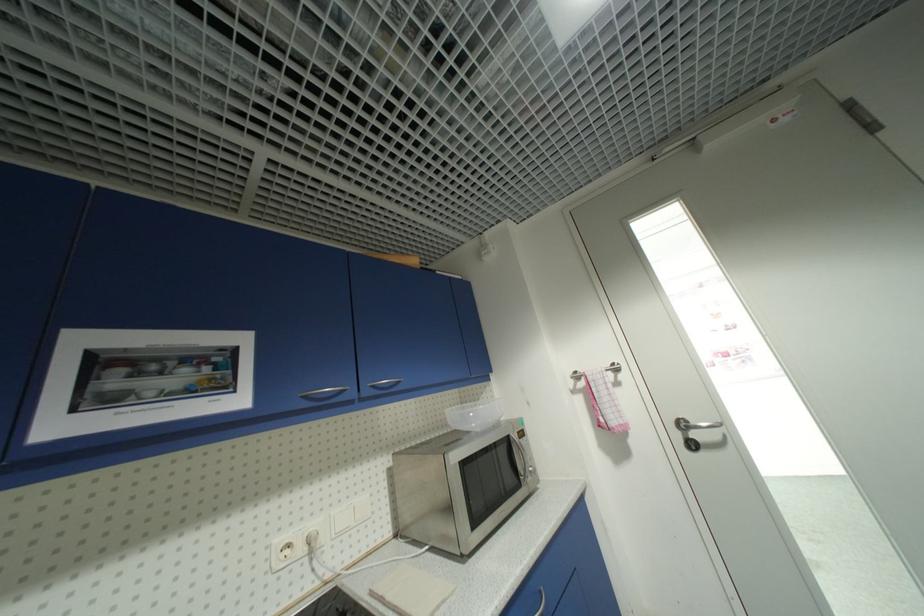
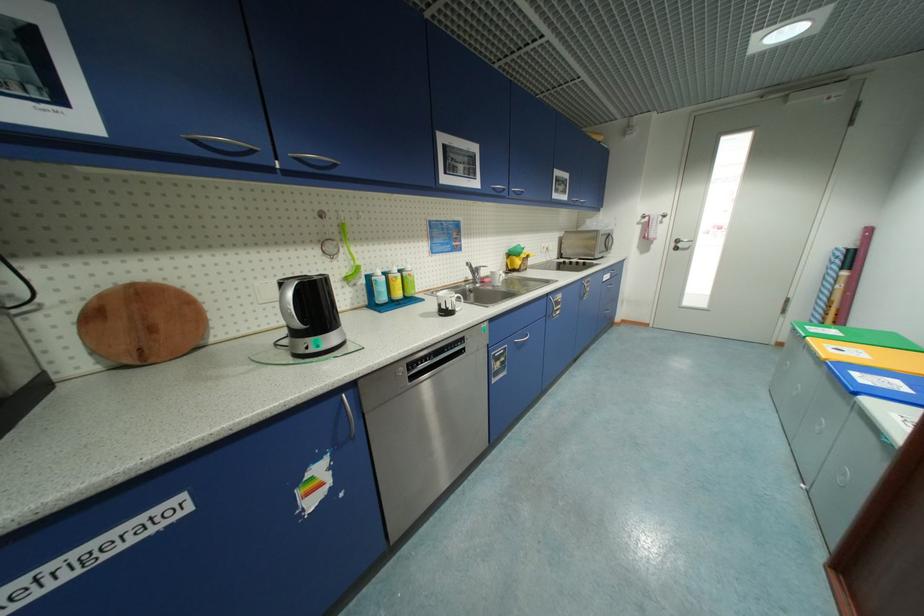
Where in the second image is the point corresponding to point 688,426 from the first image?

(684, 241)